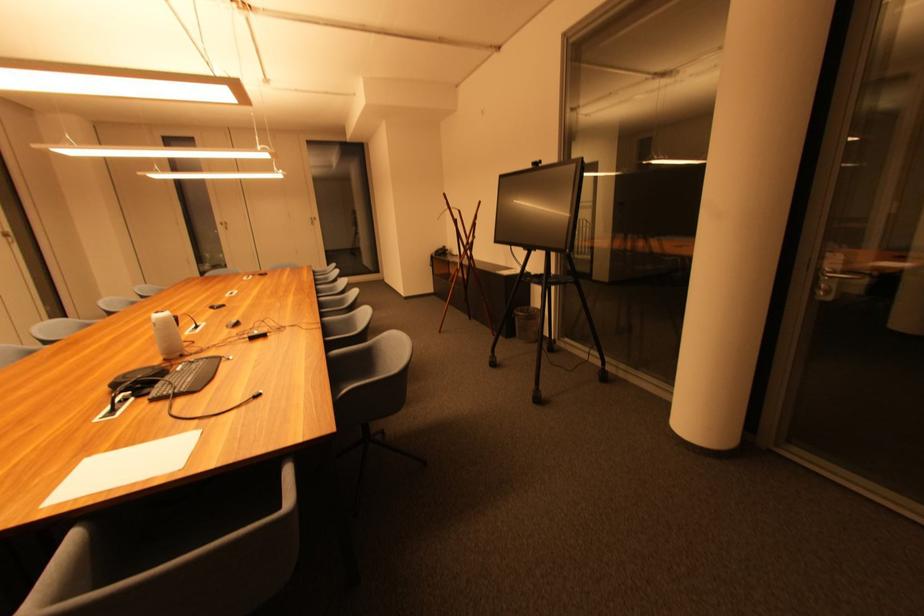
Find where to lift the white portable speaker. Please return your answer as a coordinate pair (x, y).

(166, 334)